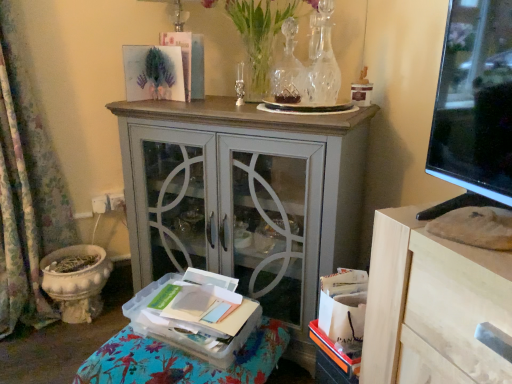
Question: From a real-world perspective, is floral fabric curtain at left under gray painted cabinet at center?

Choices:
 (A) yes
 (B) no

Answer: (B)

Question: Can you confirm if floral fabric curtain at left is wider than gray painted cabinet at center?

Choices:
 (A) yes
 (B) no

Answer: (B)

Question: From the image's perspective, does floral fabric curtain at left appear higher than gray painted cabinet at center?

Choices:
 (A) no
 (B) yes

Answer: (B)

Question: Does floral fabric curtain at left have a greater height compared to gray painted cabinet at center?

Choices:
 (A) yes
 (B) no

Answer: (A)

Question: Does floral fabric curtain at left appear on the left side of gray painted cabinet at center?

Choices:
 (A) no
 (B) yes

Answer: (B)

Question: From a real-world perspective, is clear glass vase at upper center, the second vase when ordered from left to right, physically located above or below clear plastic tray at lower left?

Choices:
 (A) below
 (B) above

Answer: (B)

Question: Is clear glass vase at upper center, the second vase when ordered from left to right, inside the boundaries of clear plastic tray at lower left, or outside?

Choices:
 (A) outside
 (B) inside

Answer: (A)

Question: In the image, is clear glass vase at upper center, the 1th vase positioned from the right, positioned in front of or behind clear plastic tray at lower left?

Choices:
 (A) front
 (B) behind

Answer: (B)

Question: Is point (315, 84) closer or farther from the camera than point (104, 352)?

Choices:
 (A) farther
 (B) closer

Answer: (A)

Question: From a real-world perspective, is floral fabric curtain at left physically located above or below clear glass vase at upper center, which ranks as the 2th vase in right-to-left order?

Choices:
 (A) below
 (B) above

Answer: (A)

Question: Would you say floral fabric curtain at left is to the left or to the right of clear glass vase at upper center, which ranks as the 2th vase in right-to-left order, in the picture?

Choices:
 (A) left
 (B) right

Answer: (A)

Question: Considering their positions, is floral fabric curtain at left located in front of or behind clear glass vase at upper center, which ranks as the 2th vase in right-to-left order?

Choices:
 (A) behind
 (B) front

Answer: (B)

Question: Is floral fabric curtain at left wider or thinner than clear glass vase at upper center, which ranks as the 2th vase in right-to-left order?

Choices:
 (A) thin
 (B) wide

Answer: (B)

Question: Is clear glass vase at upper center, acting as the 1th vase starting from the left, inside or outside of clear glass vase at upper center?

Choices:
 (A) outside
 (B) inside

Answer: (B)

Question: From a real-world perspective, is clear glass vase at upper center, acting as the 1th vase starting from the left, positioned above or below clear glass vase at upper center?

Choices:
 (A) above
 (B) below

Answer: (B)